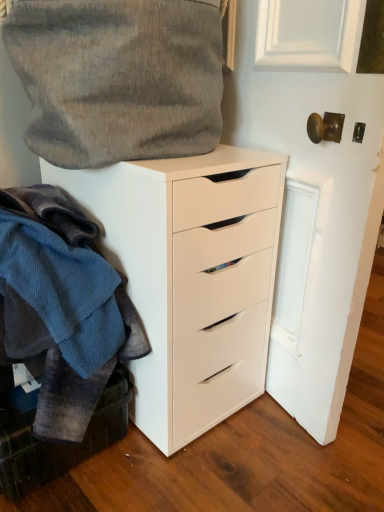
Question: From a real-world perspective, is white matte cabinet at lower left under knitted wool sweater at left?

Choices:
 (A) yes
 (B) no

Answer: (A)

Question: Is white matte cabinet at lower left bigger than knitted wool sweater at left?

Choices:
 (A) yes
 (B) no

Answer: (B)

Question: From a real-world perspective, is white matte cabinet at lower left over knitted wool sweater at left?

Choices:
 (A) yes
 (B) no

Answer: (B)

Question: Does white matte cabinet at lower left come behind knitted wool sweater at left?

Choices:
 (A) yes
 (B) no

Answer: (A)

Question: Would you say white matte cabinet at lower left is a long distance from knitted wool sweater at left?

Choices:
 (A) no
 (B) yes

Answer: (A)

Question: Considering the positions of white matte chest of drawers at center and knitted wool sweater at left in the image, is white matte chest of drawers at center taller or shorter than knitted wool sweater at left?

Choices:
 (A) short
 (B) tall

Answer: (B)

Question: Considering the positions of point (215, 223) and point (51, 437), is point (215, 223) closer or farther from the camera than point (51, 437)?

Choices:
 (A) closer
 (B) farther

Answer: (B)

Question: Considering the relative positions of white matte chest of drawers at center and knitted wool sweater at left in the image provided, is white matte chest of drawers at center to the left or to the right of knitted wool sweater at left?

Choices:
 (A) right
 (B) left

Answer: (A)

Question: From a real-world perspective, is white matte chest of drawers at center physically located above or below knitted wool sweater at left?

Choices:
 (A) above
 (B) below

Answer: (B)

Question: Is knitted wool sweater at left inside the boundaries of white matte cabinet at lower left, or outside?

Choices:
 (A) outside
 (B) inside

Answer: (A)

Question: In the image, is knitted wool sweater at left on the left side or the right side of white matte cabinet at lower left?

Choices:
 (A) left
 (B) right

Answer: (B)

Question: Considering the positions of knitted wool sweater at left and white matte cabinet at lower left in the image, is knitted wool sweater at left wider or thinner than white matte cabinet at lower left?

Choices:
 (A) wide
 (B) thin

Answer: (A)

Question: From the image's perspective, is knitted wool sweater at left positioned above or below white matte cabinet at lower left?

Choices:
 (A) above
 (B) below

Answer: (A)

Question: Visually, is white matte cabinet at lower left positioned to the left or to the right of textured gray fabric at upper left?

Choices:
 (A) left
 (B) right

Answer: (A)

Question: Is white matte cabinet at lower left spatially inside textured gray fabric at upper left, or outside of it?

Choices:
 (A) outside
 (B) inside

Answer: (A)